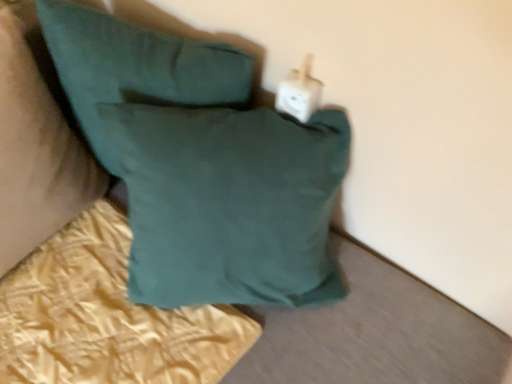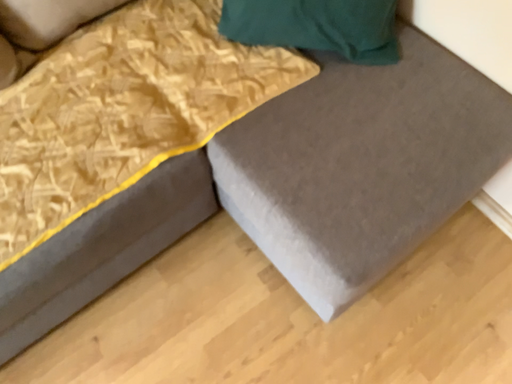
Question: Which way did the camera rotate in the video?

Choices:
 (A) rotated left
 (B) rotated right

Answer: (A)